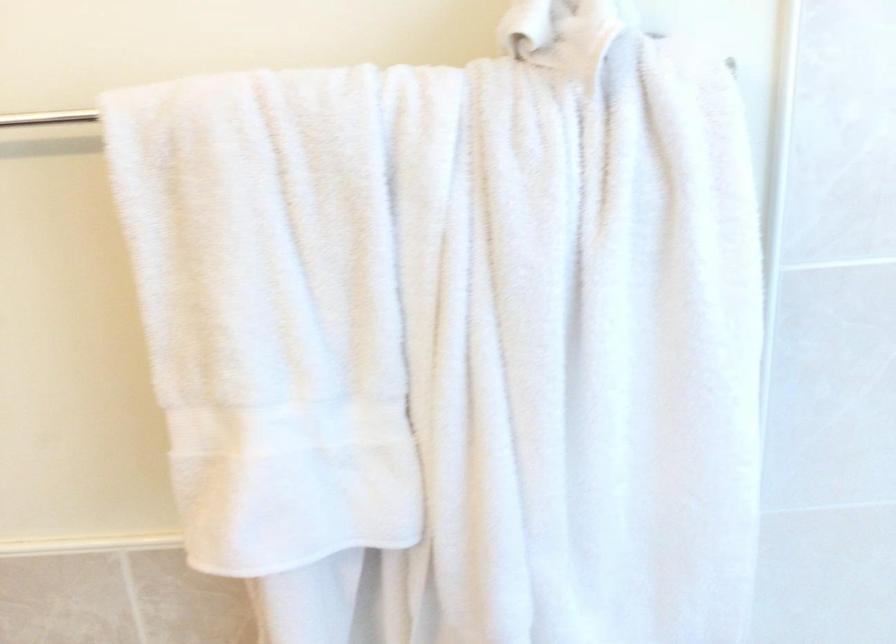
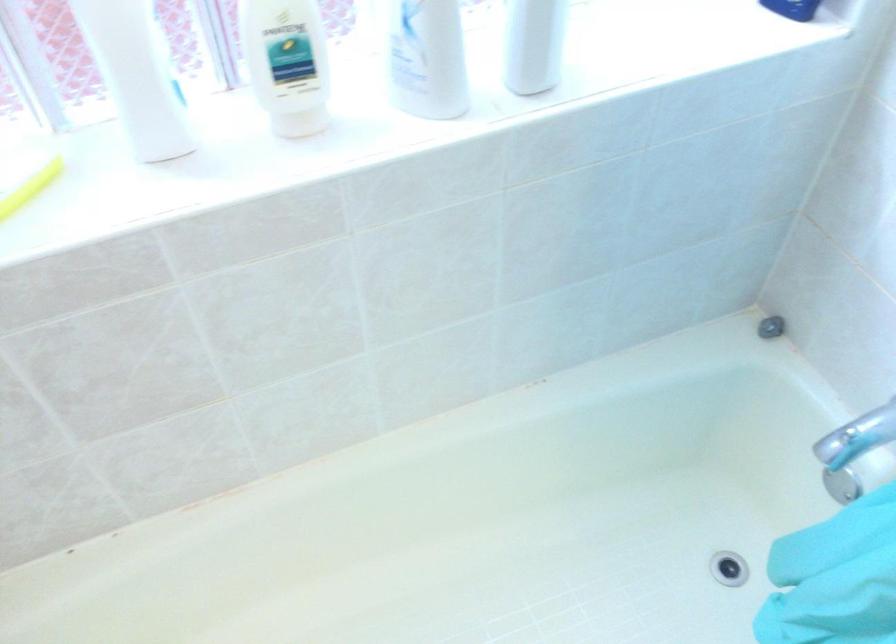
How did the camera likely rotate?

The camera's rotation is toward right-down.